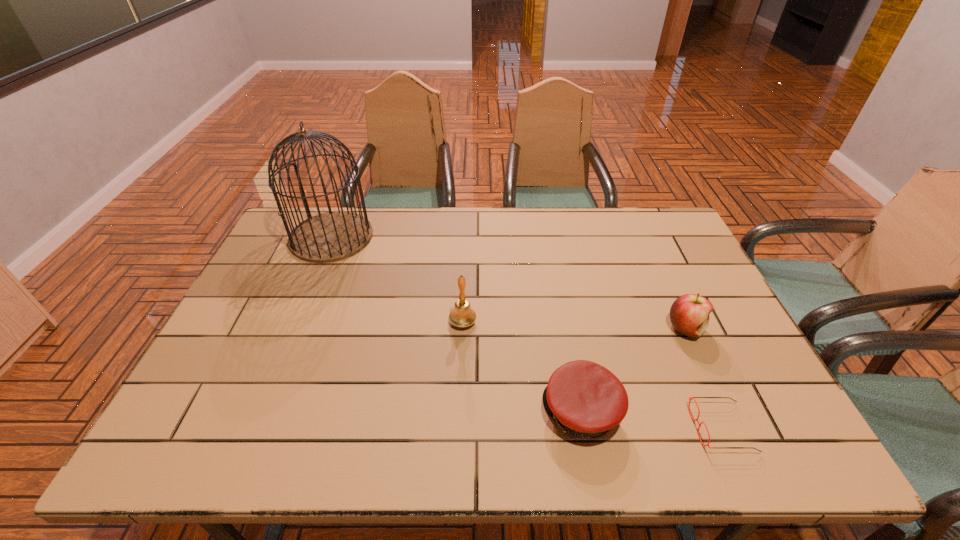
This screenshot has width=960, height=540. In order to click on object present at the left edge in this screenshot , I will do `click(333, 236)`.

Image resolution: width=960 pixels, height=540 pixels. I want to click on apple that is at the right edge, so click(x=689, y=314).

Where is `spectacles that is at the right edge`? This screenshot has width=960, height=540. spectacles that is at the right edge is located at coordinates (689, 397).

You are a GUI agent. You are given a task and a screenshot of the screen. Output one action in this format:
    pyautogui.click(x=<x>, y=<y>)
    Task: Click on the object present at the far left corner
    The height and width of the screenshot is (540, 960).
    Given the screenshot: What is the action you would take?
    pyautogui.click(x=333, y=236)

Where is `object that is at the near right corner`? The height and width of the screenshot is (540, 960). object that is at the near right corner is located at coordinates (689, 397).

The image size is (960, 540). Identify the location of free space at the far edge of the desktop. (633, 236).

Identify the location of vacant region at the near edge of the desktop. (608, 443).

Find the location of a particular element. free region at the left edge is located at coordinates (231, 400).

At what (x,y) coordinates should I click in order to perform the action: click on free point at the right edge. Please return your answer as a coordinate pair (x, y). Looking at the image, I should click on (747, 404).

You are a GUI agent. You are given a task and a screenshot of the screen. Output one action in this format:
    pyautogui.click(x=<x>, y=<y>)
    Task: Click on the vacant point located between the second object from left to right and the farthest object
    The image size is (960, 540).
    Given the screenshot: What is the action you would take?
    pyautogui.click(x=397, y=279)